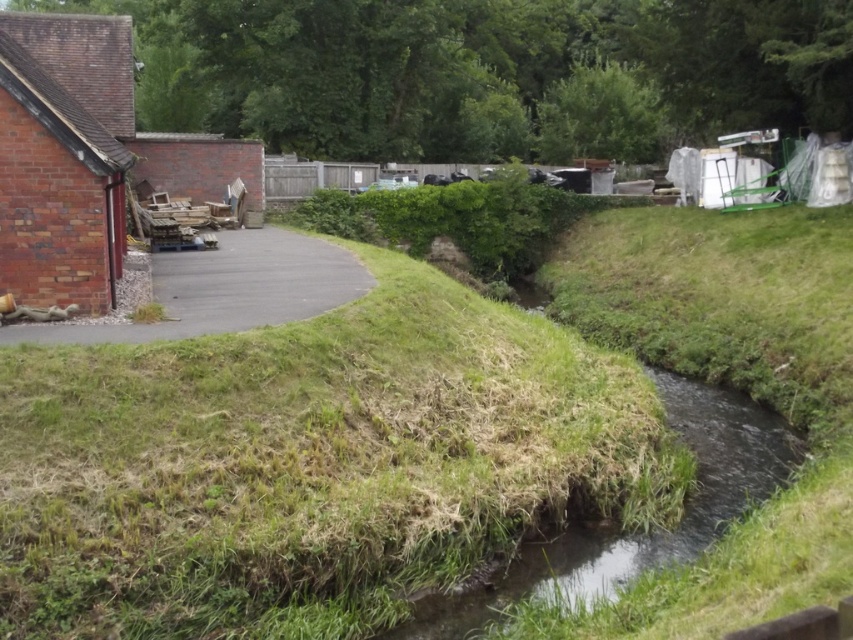
Question: Which point is farther to the camera?

Choices:
 (A) (689, 384)
 (B) (236, 566)
 (C) (316, 276)

Answer: (A)

Question: Observing the image, what is the correct spatial positioning of green grass at center in reference to asphalt road at left?

Choices:
 (A) right
 (B) left

Answer: (A)

Question: Which point is farther from the camera taking this photo?

Choices:
 (A) (785, 442)
 (B) (573, 461)
 (C) (236, 282)

Answer: (C)

Question: Among these objects, which one is farthest from the camera?

Choices:
 (A) asphalt road at left
 (B) green grassy stream at lower right

Answer: (A)

Question: Considering the relative positions of green grassy stream at lower right and asphalt road at left in the image provided, where is green grassy stream at lower right located with respect to asphalt road at left?

Choices:
 (A) below
 (B) above

Answer: (A)

Question: Is green grass at center further to camera compared to asphalt road at left?

Choices:
 (A) yes
 (B) no

Answer: (B)